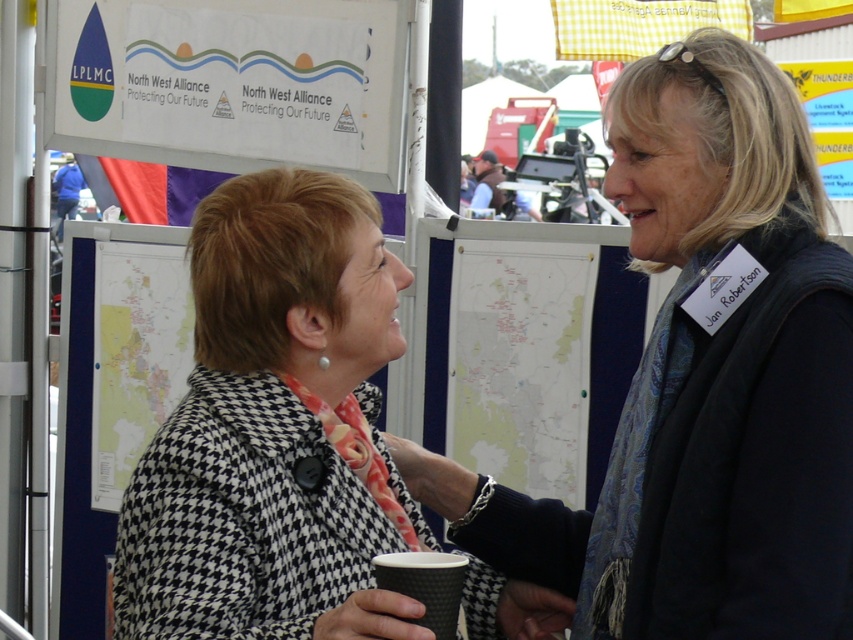
You are standing at the center of the event and see two points marked in the image. Which point is closer to you, point (358,605) or point (393,588)?

Point (358,605) is in front of point (393,588), so it is closer to you.

You are a photographer at the event and want to capture both the houndstooth coat at center and the black paper cup at center in a single frame. Given that your camera has a fixed focus that can only clearly capture objects within a 20cm width, will both items fit within the focus area if they are placed side by side?

The houndstooth coat at center is wider than the black paper cup at center. Since the total width of both items together would exceed the 20cm focus area, they cannot both fit within the focus area simultaneously.